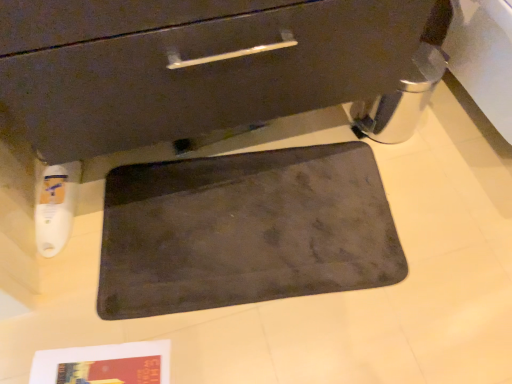
Question: Can you confirm if matte black drawer at center is bigger than dark gray matte bath mat at center?

Choices:
 (A) yes
 (B) no

Answer: (A)

Question: Is matte black drawer at center not inside dark gray matte bath mat at center?

Choices:
 (A) no
 (B) yes

Answer: (B)

Question: Considering the relative sizes of matte black drawer at center and dark gray matte bath mat at center in the image provided, is matte black drawer at center thinner than dark gray matte bath mat at center?

Choices:
 (A) yes
 (B) no

Answer: (B)

Question: Could dark gray matte bath mat at center be considered to be inside matte black drawer at center?

Choices:
 (A) yes
 (B) no

Answer: (B)

Question: From a real-world perspective, is matte black drawer at center below dark gray matte bath mat at center?

Choices:
 (A) no
 (B) yes

Answer: (A)

Question: Is matte black drawer at center shorter than dark gray matte bath mat at center?

Choices:
 (A) yes
 (B) no

Answer: (B)

Question: From a real-world perspective, is dark gray matte bath mat at center physically above matte black drawer at center?

Choices:
 (A) no
 (B) yes

Answer: (A)

Question: Is dark gray matte bath mat at center not inside matte black drawer at center?

Choices:
 (A) yes
 (B) no

Answer: (A)

Question: Does dark gray matte bath mat at center have a larger size compared to matte black drawer at center?

Choices:
 (A) no
 (B) yes

Answer: (A)

Question: Is the depth of dark gray matte bath mat at center greater than that of matte black drawer at center?

Choices:
 (A) yes
 (B) no

Answer: (A)

Question: Is the depth of dark gray matte bath mat at center less than that of matte black drawer at center?

Choices:
 (A) yes
 (B) no

Answer: (B)

Question: Is dark gray matte bath mat at center far from matte black drawer at center?

Choices:
 (A) yes
 (B) no

Answer: (B)

Question: Is point (267, 226) positioned closer to the camera than point (350, 69)?

Choices:
 (A) farther
 (B) closer

Answer: (A)